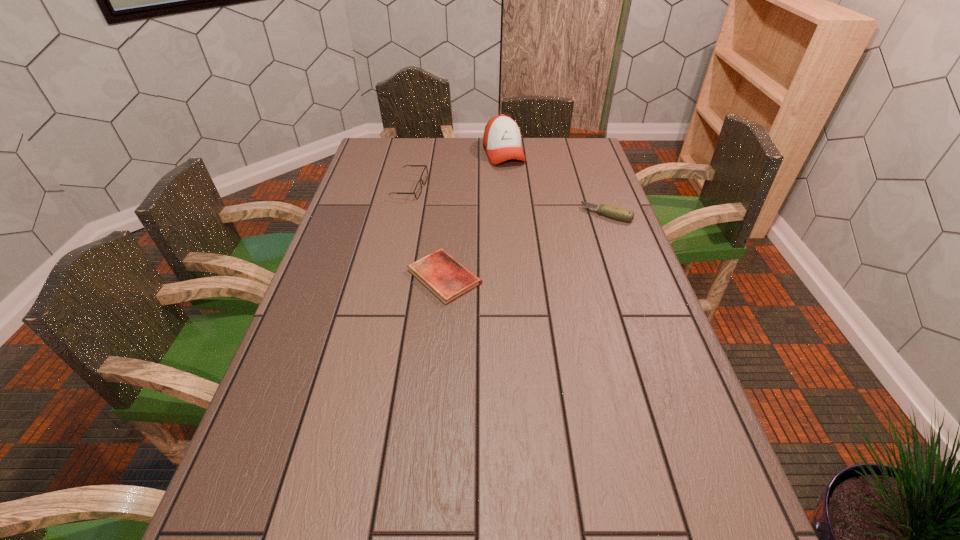
Image resolution: width=960 pixels, height=540 pixels. Identify the location of vacant space located on the front-facing side of the baseball cap. (532, 215).

Locate an element on the screen. This screenshot has height=540, width=960. blank area located 0.180m on the front-facing side of the baseball cap is located at coordinates (521, 194).

The height and width of the screenshot is (540, 960). I want to click on free spot located on the front-facing side of the baseball cap, so click(514, 177).

Locate an element on the screen. This screenshot has height=540, width=960. vacant space situated 0.160m with the lenses facing outward on the second farthest object is located at coordinates (457, 213).

The height and width of the screenshot is (540, 960). In order to click on vacant space located with the lenses facing outward on the second farthest object in this screenshot , I will do pyautogui.click(x=444, y=207).

You are a GUI agent. You are given a task and a screenshot of the screen. Output one action in this format:
    pyautogui.click(x=<x>, y=<y>)
    Task: Click on the free spot located 0.180m with the lenses facing outward on the second farthest object
    Image resolution: width=960 pixels, height=540 pixels.
    Given the screenshot: What is the action you would take?
    pyautogui.click(x=461, y=215)

This screenshot has height=540, width=960. Identify the location of object at the far edge. (502, 138).

The width and height of the screenshot is (960, 540). Find the location of `object located at the left edge`. object located at the left edge is located at coordinates (418, 189).

Locate an element on the screen. Image resolution: width=960 pixels, height=540 pixels. object that is at the right edge is located at coordinates (614, 212).

I want to click on vacant space at the far edge, so click(431, 145).